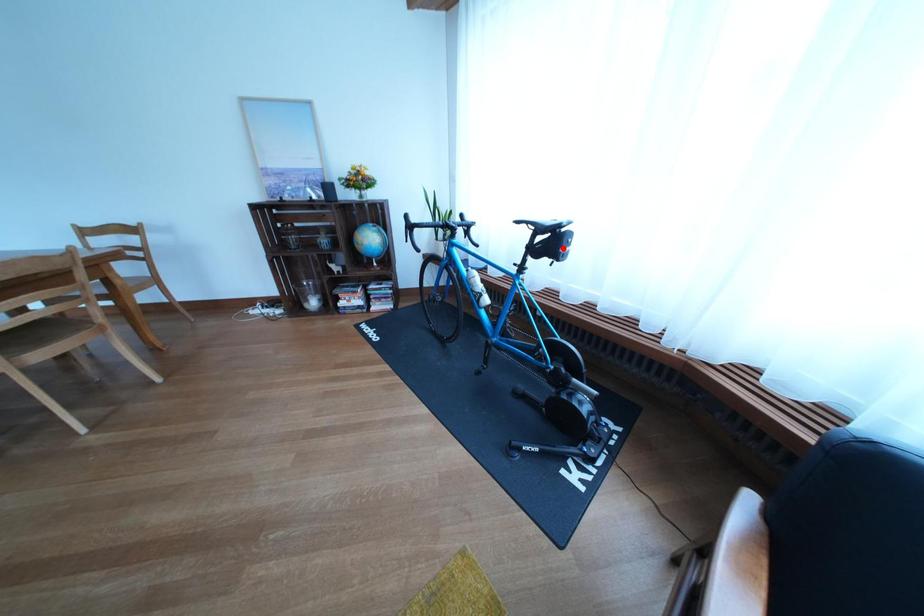
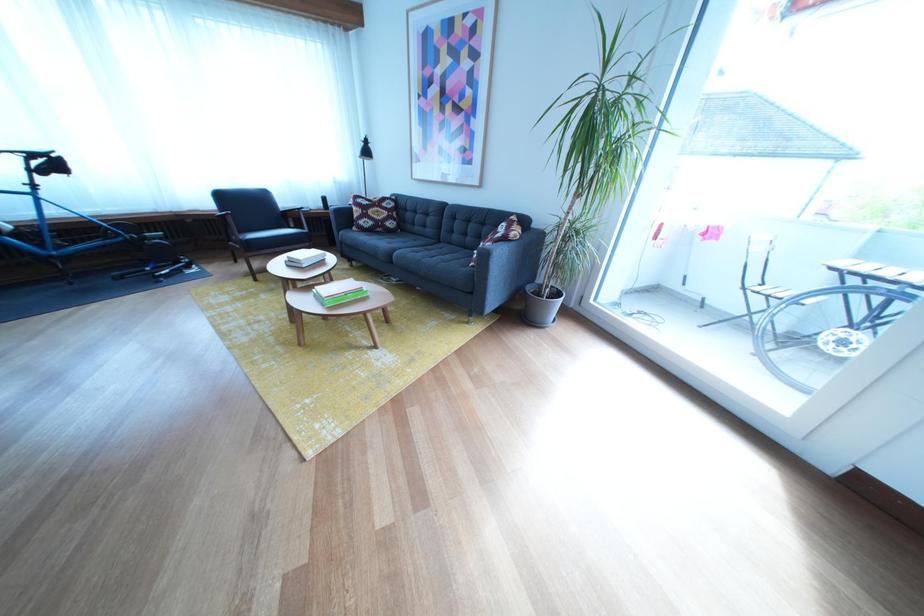
Question: I am providing you with two images of the same scene from different viewpoints. A red point is marked on the first image. Is the red point's position out of view in image 2?

Choices:
 (A) Yes
 (B) No

Answer: (B)